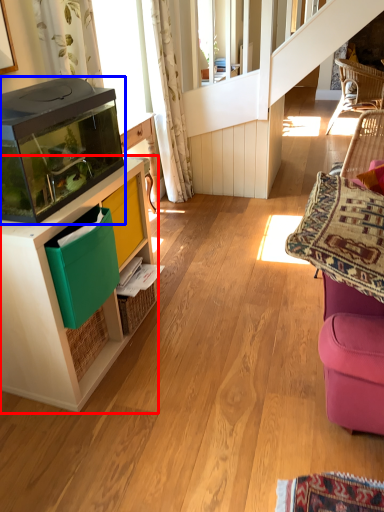
Question: Which point is closer to the camera, cabinetry (highlighted by a red box) or appliance (highlighted by a blue box)?

Choices:
 (A) cabinetry
 (B) appliance

Answer: (B)